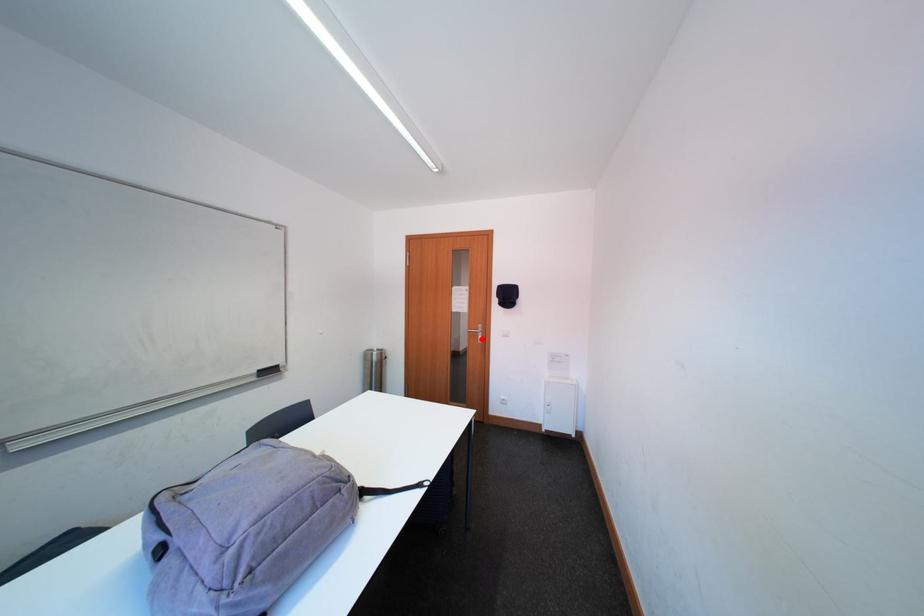
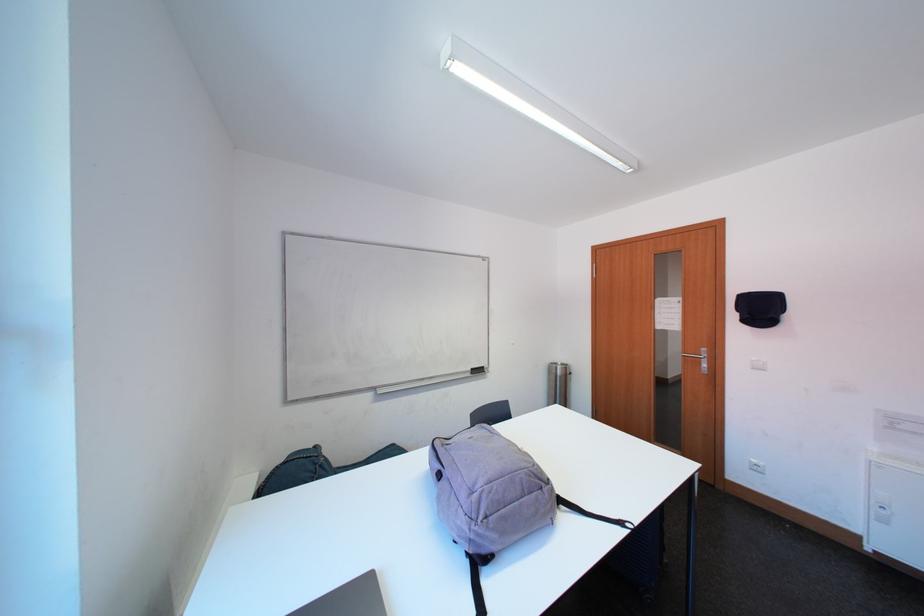
Question: I am providing you with two images of the same scene from different viewpoints. Image1 has a red point marked. In image2, the corresponding 3D location appears at what relative position? Reply with the corresponding letter.

Choices:
 (A) Closer
 (B) Farther

Answer: (A)